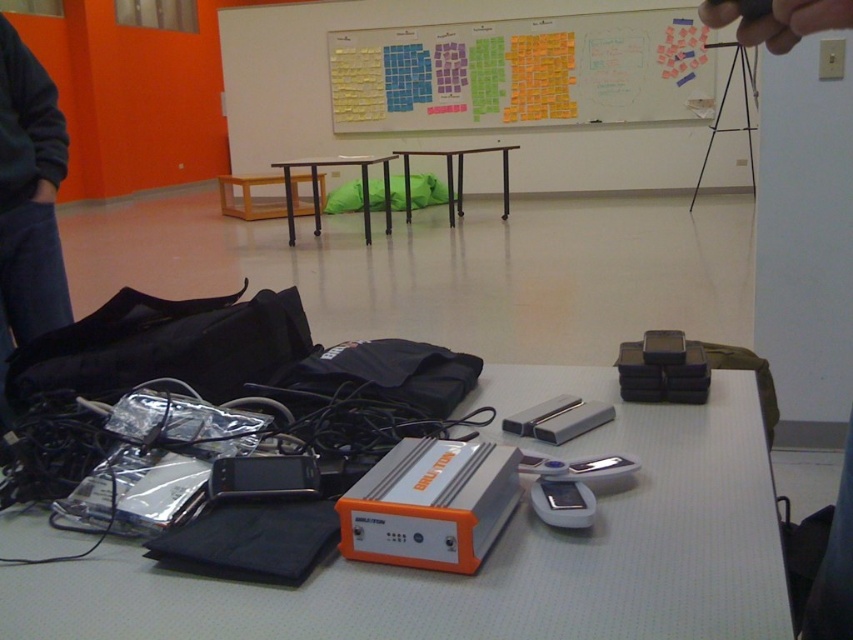
Looking at this image, does metallic silver tripod at upper right have a greater width compared to metallic gray table at center?

In fact, metallic silver tripod at upper right might be narrower than metallic gray table at center.

Between point (753, 83) and point (451, 163), which one is positioned behind?

The point (451, 163) is behind.

Measure the distance between metallic silver tripod at upper right and camera.

metallic silver tripod at upper right and camera are 23.25 feet apart from each other.

In order to click on metallic silver tripod at upper right in this screenshot , I will do `click(723, 106)`.

In the scene shown: Is black plastic table at center behind metallic gray table at center?

No.

In the scene shown: Does black plastic table at center appear on the left side of metallic gray table at center?

Correct, you'll find black plastic table at center to the left of metallic gray table at center.

Is point (286, 168) less distant than point (503, 150)?

Yes, it is.

In order to click on black plastic table at center in this screenshot , I will do `click(318, 195)`.

Is orange plastic device at center bigger than black plastic table at center?

No.

At what (x,y) coordinates should I click in order to perform the action: click on orange plastic device at center. Please return your answer as a coordinate pair (x, y). Looking at the image, I should click on (498, 550).

I want to click on orange plastic device at center, so (x=498, y=550).